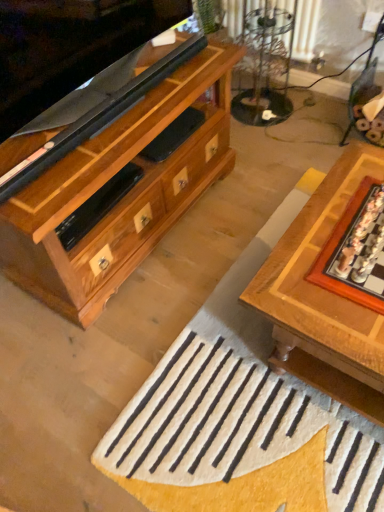
Question: Is white woolen doormat at center inside clear glass table at upper center?

Choices:
 (A) yes
 (B) no

Answer: (B)

Question: Does clear glass table at upper center come behind white woolen doormat at center?

Choices:
 (A) no
 (B) yes

Answer: (B)

Question: Can we say clear glass table at upper center lies outside white woolen doormat at center?

Choices:
 (A) no
 (B) yes

Answer: (B)

Question: From a real-world perspective, is clear glass table at upper center on top of white woolen doormat at center?

Choices:
 (A) no
 (B) yes

Answer: (B)

Question: From a real-world perspective, is clear glass table at upper center under white woolen doormat at center?

Choices:
 (A) no
 (B) yes

Answer: (A)

Question: In terms of width, does wooden board game at right look wider or thinner when compared to wooden chessboard at center?

Choices:
 (A) wide
 (B) thin

Answer: (B)

Question: Based on their positions, is wooden board game at right located to the left or right of wooden chessboard at center?

Choices:
 (A) left
 (B) right

Answer: (B)

Question: Is point (345, 268) closer or farther from the camera than point (289, 326)?

Choices:
 (A) closer
 (B) farther

Answer: (B)

Question: Do you think wooden board game at right is within wooden chessboard at center, or outside of it?

Choices:
 (A) outside
 (B) inside

Answer: (B)

Question: Does point (357, 288) appear closer or farther from the camera than point (127, 489)?

Choices:
 (A) farther
 (B) closer

Answer: (B)

Question: From the image's perspective, is wooden board game at right above or below white woolen doormat at center?

Choices:
 (A) below
 (B) above

Answer: (B)

Question: Relative to white woolen doormat at center, is wooden board game at right in front or behind?

Choices:
 (A) behind
 (B) front

Answer: (B)

Question: In terms of height, does wooden board game at right look taller or shorter compared to white woolen doormat at center?

Choices:
 (A) tall
 (B) short

Answer: (B)

Question: Is white woolen doormat at center spatially inside wooden board game at right, or outside of it?

Choices:
 (A) inside
 (B) outside

Answer: (B)

Question: From the image's perspective, is white woolen doormat at center located above or below wooden board game at right?

Choices:
 (A) above
 (B) below

Answer: (B)